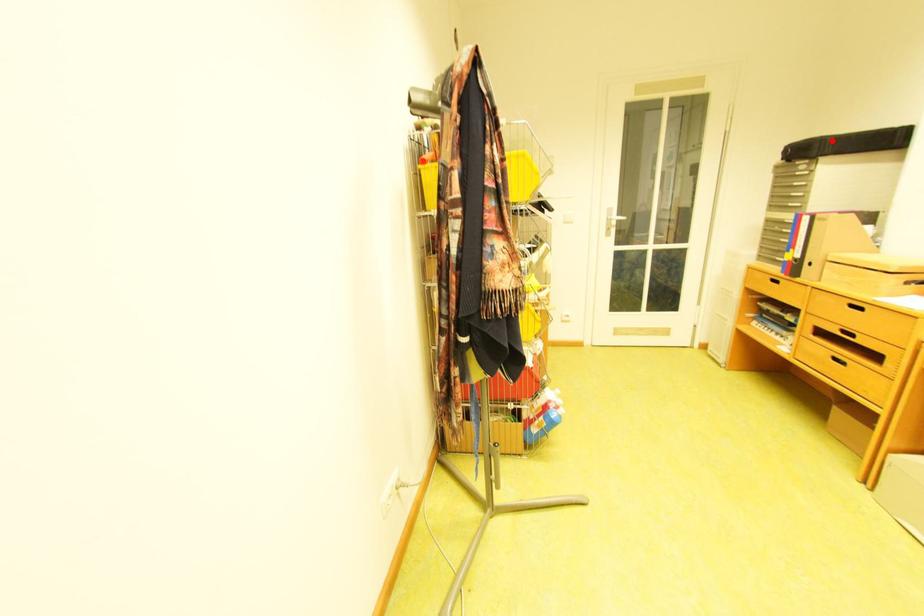
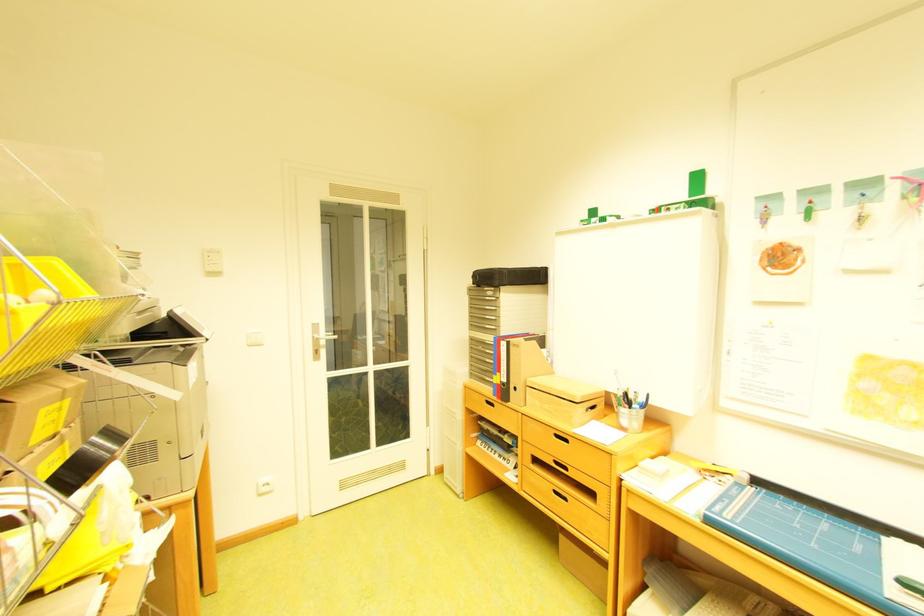
Locate, in the second image, the point that corresponds to the highlighted location in the first image.

(511, 272)